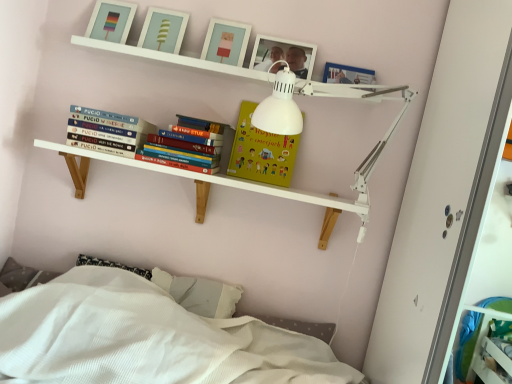
Question: Is matte white picture frame at upper center, which is counted as the 3th picture frame, starting from the left, smaller than white wooden shelf at upper center, marked as the first shelf in a bottom-to-top arrangement?

Choices:
 (A) yes
 (B) no

Answer: (A)

Question: Does matte white picture frame at upper center, which is counted as the 3th picture frame, starting from the left, come in front of white wooden shelf at upper center, marked as the first shelf in a bottom-to-top arrangement?

Choices:
 (A) yes
 (B) no

Answer: (B)

Question: Is the depth of matte white picture frame at upper center, the 3th picture frame from the right, greater than that of white wooden shelf at upper center, marked as the first shelf in a bottom-to-top arrangement?

Choices:
 (A) yes
 (B) no

Answer: (A)

Question: Is matte white picture frame at upper center, which is counted as the 3th picture frame, starting from the left, positioned far away from white wooden shelf at upper center, which is counted as the second shelf, starting from the top?

Choices:
 (A) yes
 (B) no

Answer: (B)

Question: Can you confirm if matte white picture frame at upper center, which is counted as the 3th picture frame, starting from the left, is positioned to the left of white wooden shelf at upper center, marked as the first shelf in a bottom-to-top arrangement?

Choices:
 (A) yes
 (B) no

Answer: (B)

Question: Is matte white picture frame at upper center, which is counted as the 3th picture frame, starting from the left, wider than white wooden shelf at upper center, which is counted as the second shelf, starting from the top?

Choices:
 (A) yes
 (B) no

Answer: (B)

Question: Considering the relative positions of wooden picture frame at upper center, which ranks as the fifth picture frame in left-to-right order, and yellow matte paper at upper center in the image provided, is wooden picture frame at upper center, which ranks as the fifth picture frame in left-to-right order, to the left of yellow matte paper at upper center from the viewer's perspective?

Choices:
 (A) yes
 (B) no

Answer: (B)

Question: From the image's perspective, is wooden picture frame at upper center, positioned as the first picture frame in right-to-left order, under yellow matte paper at upper center?

Choices:
 (A) no
 (B) yes

Answer: (A)

Question: From a real-world perspective, is wooden picture frame at upper center, positioned as the first picture frame in right-to-left order, on yellow matte paper at upper center?

Choices:
 (A) no
 (B) yes

Answer: (B)

Question: Is wooden picture frame at upper center, which ranks as the fifth picture frame in left-to-right order, shorter than yellow matte paper at upper center?

Choices:
 (A) no
 (B) yes

Answer: (B)

Question: Can you confirm if wooden picture frame at upper center, which ranks as the fifth picture frame in left-to-right order, is taller than yellow matte paper at upper center?

Choices:
 (A) no
 (B) yes

Answer: (A)

Question: Is the depth of wooden picture frame at upper center, positioned as the first picture frame in right-to-left order, less than that of yellow matte paper at upper center?

Choices:
 (A) no
 (B) yes

Answer: (B)

Question: Considering the relative positions of matte plastic picture frame at upper center, the fifth picture frame in the right-to-left sequence, and white wooden shelf at upper center, which is counted as the second shelf, starting from the top, in the image provided, is matte plastic picture frame at upper center, the fifth picture frame in the right-to-left sequence, behind white wooden shelf at upper center, which is counted as the second shelf, starting from the top,?

Choices:
 (A) no
 (B) yes

Answer: (B)